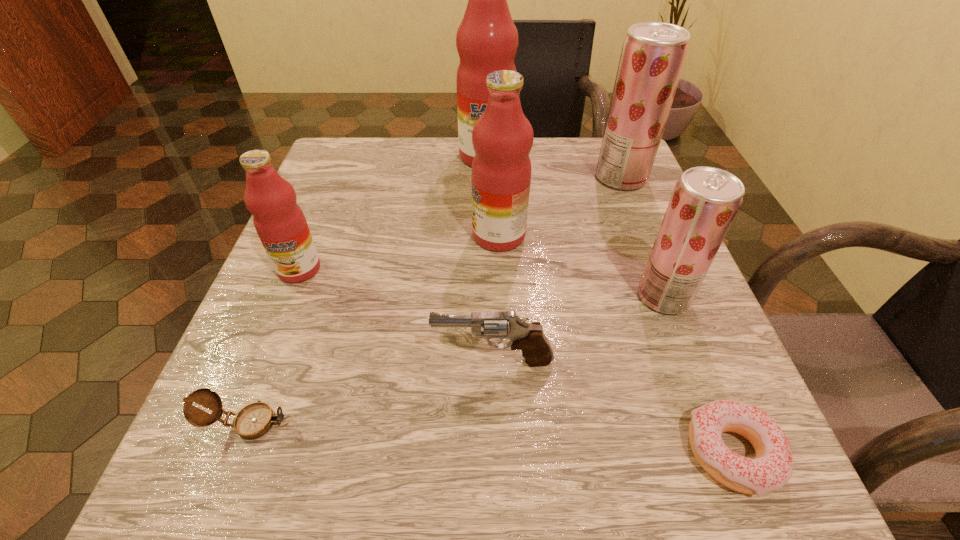
This screenshot has height=540, width=960. Find the location of `object present at the near left corner`. object present at the near left corner is located at coordinates (254, 420).

Image resolution: width=960 pixels, height=540 pixels. I want to click on object present at the far right corner, so click(x=653, y=54).

The height and width of the screenshot is (540, 960). I want to click on object that is at the near right corner, so click(x=772, y=467).

In the image, there is a desktop. Identify the location of vacant space at the far edge. The width and height of the screenshot is (960, 540). (550, 155).

Locate an element on the screen. Image resolution: width=960 pixels, height=540 pixels. free space at the near edge of the desktop is located at coordinates (521, 465).

Find the location of a particular element. The width and height of the screenshot is (960, 540). vacant space at the right edge of the desktop is located at coordinates (611, 230).

Find the location of a particular element. Image resolution: width=960 pixels, height=540 pixels. blank space at the far left corner of the desktop is located at coordinates tap(360, 169).

This screenshot has width=960, height=540. Find the location of `empty location between the smallest pink fruit juice and the compass`. empty location between the smallest pink fruit juice and the compass is located at coordinates (274, 346).

I want to click on free space that is in between the third nearest fruit juice and the second shortest object, so click(373, 329).

Identify the location of vacant area that lies between the nearest pink fruit juice and the pistol. (396, 315).